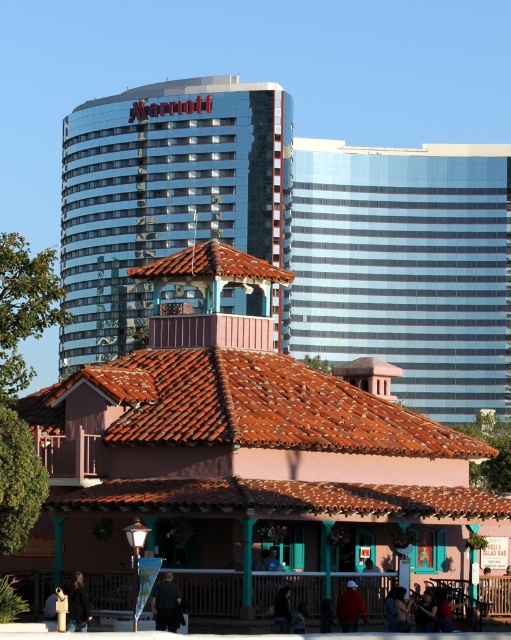
In the scene shown: Who is higher up, glassy blue skyscraper at upper right or glassy blue skyscraper at upper center?

Positioned higher is glassy blue skyscraper at upper right.

Measure the distance between glassy blue skyscraper at upper right and glassy blue skyscraper at upper center.

A distance of 16.05 meters exists between glassy blue skyscraper at upper right and glassy blue skyscraper at upper center.

Between point (503, 157) and point (245, 214), which one is positioned behind?

The point (503, 157) is behind.

Find the location of a particular element. glassy blue skyscraper at upper right is located at coordinates (406, 268).

Between matte teal tower at center and glassy blue skyscraper at upper center, which one appears on the left side from the viewer's perspective?

From the viewer's perspective, glassy blue skyscraper at upper center appears more on the left side.

Is matte teal tower at center further to camera compared to glassy blue skyscraper at upper center?

No, matte teal tower at center is closer to the viewer.

Which is behind, point (233, 320) or point (146, 131)?

Positioned behind is point (146, 131).

This screenshot has width=511, height=640. Find the location of `matte teal tower at center`. matte teal tower at center is located at coordinates [x=247, y=448].

Who is higher up, matte teal tower at center or glassy blue skyscraper at upper right?

glassy blue skyscraper at upper right is higher up.

Is point (373, 436) behind point (506, 173)?

No, (373, 436) is in front of (506, 173).

Which is behind, point (196, 285) or point (335, 205)?

Positioned behind is point (335, 205).

At what (x,y) coordinates should I click in order to perform the action: click on matte teal tower at center. Please return your answer as a coordinate pair (x, y). The height and width of the screenshot is (640, 511). Looking at the image, I should click on (247, 448).